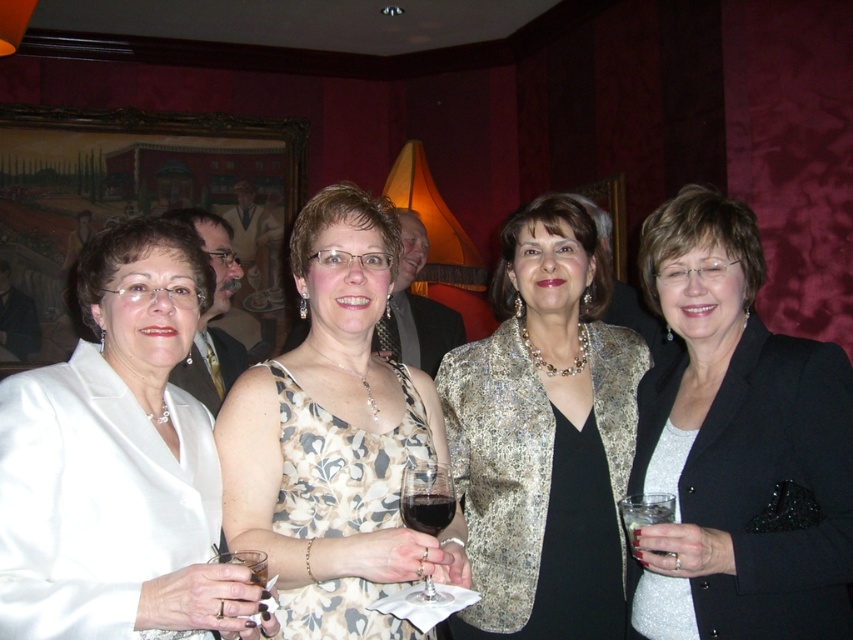
Question: Does gold textured blazer at center have a lesser width compared to clear glass wine glass at lower left?

Choices:
 (A) yes
 (B) no

Answer: (B)

Question: Is printed silk dress at center positioned before gold textured blazer at center?

Choices:
 (A) yes
 (B) no

Answer: (A)

Question: Which of these objects is positioned closest to the translucent glass wine glass at center?

Choices:
 (A) gold textured blazer at center
 (B) clear glass wine glass at lower left
 (C) printed silk dress at center
 (D) clear plastic glass at lower right

Answer: (C)

Question: Which of the following is the closest to the observer?

Choices:
 (A) clear plastic glass at lower right
 (B) dark glass wine at center
 (C) printed silk dress at center

Answer: (C)

Question: Can you confirm if black satin blazer at center is positioned to the left of clear plastic glass at lower right?

Choices:
 (A) no
 (B) yes

Answer: (A)

Question: Estimate the real-world distances between objects in this image. Which object is farther from the gold textured blazer at center?

Choices:
 (A) printed silk dress at center
 (B) black satin blazer at center
 (C) clear glass wine glass at lower left

Answer: (C)